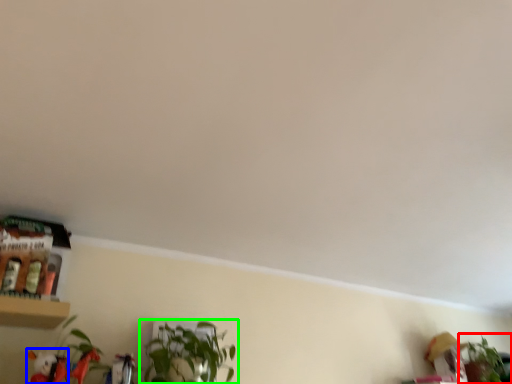
Question: Considering the real-world distances, which object is closest to houseplant (highlighted by a red box)? toy (highlighted by a blue box) or houseplant (highlighted by a green box).

Choices:
 (A) toy
 (B) houseplant

Answer: (B)